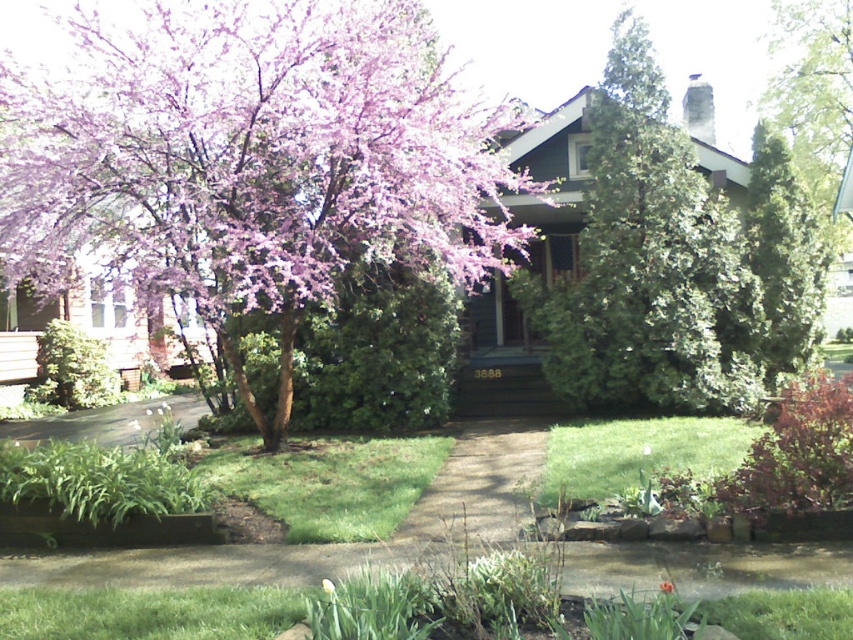
Does green textured evergreen tree at upper center have a smaller size compared to orange matte flower at center?

Incorrect, green textured evergreen tree at upper center is not smaller in size than orange matte flower at center.

Between green textured evergreen tree at upper center and orange matte flower at center, which one is positioned higher?

green textured evergreen tree at upper center

Who is more forward, (752, 404) or (672, 586)?

Point (672, 586)

Identify the location of green textured evergreen tree at upper center. (650, 262).

Looking at this image, is the position of green textured evergreen tree at upper center more distant than that of green textured evergreen tree at right?

No, green textured evergreen tree at upper center is in front of green textured evergreen tree at right.

Between green textured evergreen tree at upper center and green textured evergreen tree at right, which one is positioned higher?

green textured evergreen tree at upper center is higher up.

Is point (607, 368) in front of point (761, 300)?

Yes, it is.

Where is `green textured evergreen tree at upper center`? The height and width of the screenshot is (640, 853). green textured evergreen tree at upper center is located at coordinates click(x=650, y=262).

Which is more to the left, green leafy tree at upper right or green textured evergreen tree at right?

From the viewer's perspective, green textured evergreen tree at right appears more on the left side.

Does green leafy tree at upper right lie behind green textured evergreen tree at right?

Yes, green leafy tree at upper right is behind green textured evergreen tree at right.

Does point (793, 93) come in front of point (801, 348)?

No, (793, 93) is behind (801, 348).

Locate an element on the screen. Image resolution: width=853 pixels, height=640 pixels. green leafy tree at upper right is located at coordinates (811, 90).